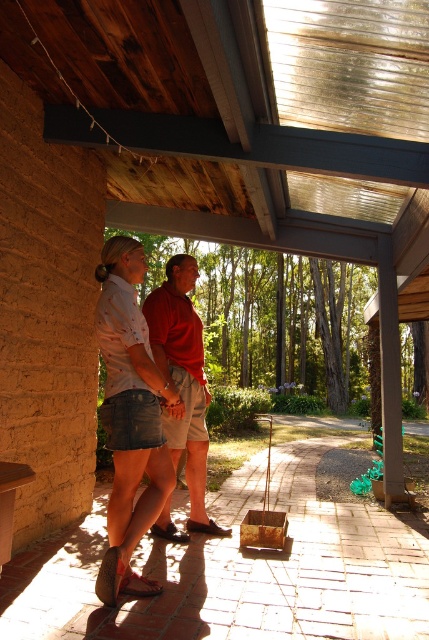
Question: Among these points, which one is farthest from the camera?

Choices:
 (A) (184, 560)
 (B) (123, 547)
 (C) (202, 419)

Answer: (C)

Question: Can you confirm if denim skirt at center is smaller than matte red shirt at center?

Choices:
 (A) yes
 (B) no

Answer: (A)

Question: Does denim skirt at center have a greater width compared to matte red shirt at center?

Choices:
 (A) yes
 (B) no

Answer: (B)

Question: Among these objects, which one is nearest to the camera?

Choices:
 (A) matte red shirt at center
 (B) brown brick porch at lower center
 (C) denim skirt at center

Answer: (B)

Question: Which object is the closest to the denim skirt at center?

Choices:
 (A) matte red shirt at center
 (B) brown brick porch at lower center

Answer: (A)

Question: Observing the image, what is the correct spatial positioning of brown brick porch at lower center in reference to matte red shirt at center?

Choices:
 (A) right
 (B) left

Answer: (A)